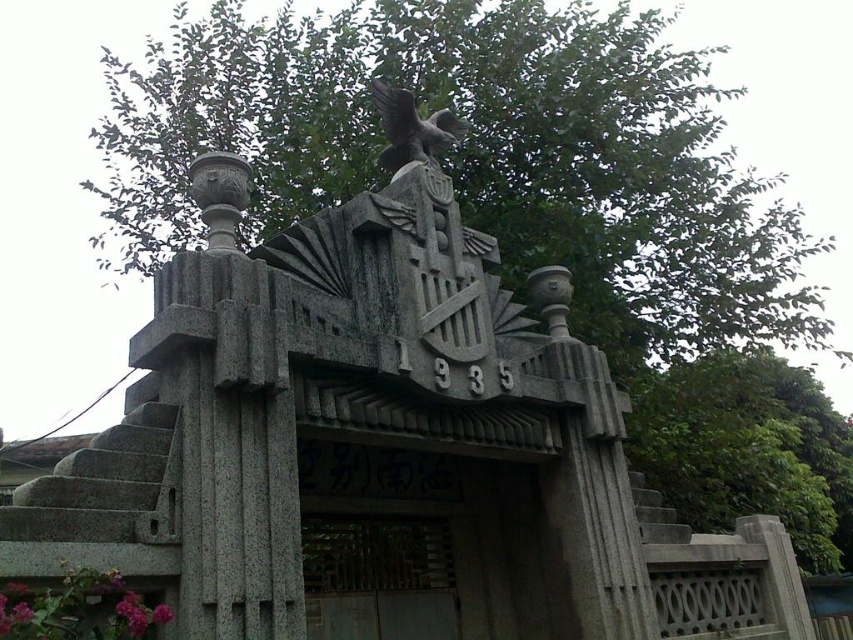
Question: Among these points, which one is nearest to the camera?

Choices:
 (A) (387, 122)
 (B) (631, 392)
 (C) (154, 186)
 (D) (349, 515)

Answer: (D)

Question: Is green leafy tree at upper center above wooden gate at center?

Choices:
 (A) no
 (B) yes

Answer: (B)

Question: Which object appears closest to the camera in this image?

Choices:
 (A) gray stone eagle at upper center
 (B) green leafy tree at upper center
 (C) wooden gate at center

Answer: (C)

Question: Is wooden gate at center bigger than gray stone eagle at upper center?

Choices:
 (A) yes
 (B) no

Answer: (A)

Question: Which point is closer to the camera?

Choices:
 (A) wooden gate at center
 (B) green leafy tree at upper center

Answer: (A)

Question: Does green leafy tree at upper right come behind wooden gate at center?

Choices:
 (A) no
 (B) yes

Answer: (B)